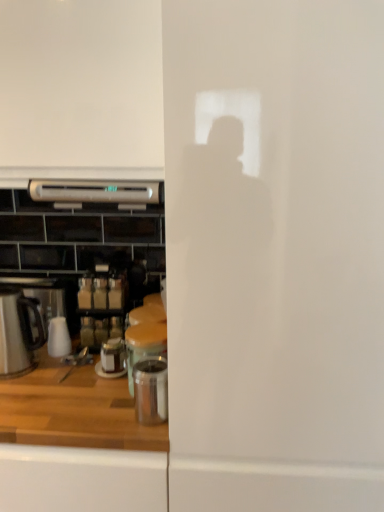
Question: Is polished stainless steel container at lower center, which ranks as the 3th appliance in back-to-front order, bigger or smaller than metallic glass jar at center, which is counted as the first appliance, starting from the back?

Choices:
 (A) small
 (B) big

Answer: (B)

Question: Is point (x=157, y=373) positioned closer to the camera than point (x=112, y=355)?

Choices:
 (A) closer
 (B) farther

Answer: (A)

Question: Which object is the closest to the metallic glass jar at center, which is counted as the first appliance, starting from the back?

Choices:
 (A) polished stainless steel container at lower center, which is the 1th appliance from front to back
 (B) satin silver microwave at upper center, marked as the second kitchen appliance in a bottom-to-top arrangement
 (C) metallic silver canister at center, positioned as the 2th appliance in back-to-front order
 (D) white glossy microwave at upper left
 (E) stainless steel kettle at left, which is the 1th kitchen appliance in left-to-right order

Answer: (C)

Question: Which object is positioned closest to the polished stainless steel container at lower center, which ranks as the 3th appliance in back-to-front order?

Choices:
 (A) metallic silver canister at center, which is counted as the second appliance, starting from the front
 (B) satin silver microwave at upper center, marked as the second kitchen appliance in a bottom-to-top arrangement
 (C) stainless steel kettle at left, acting as the 1th kitchen appliance starting from the bottom
 (D) white glossy microwave at upper left
 (E) metallic glass jar at center, which is counted as the first appliance, starting from the back

Answer: (A)